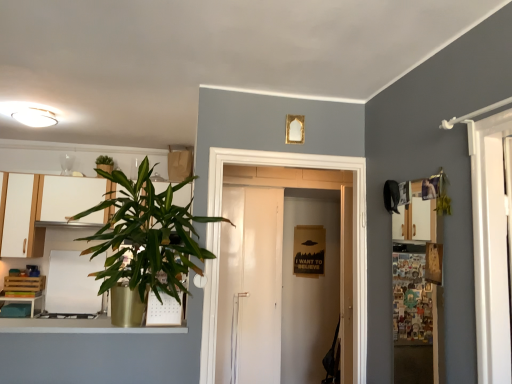
Question: Is white matte cabinet at left, positioned as the first cabinetry in right-to-left order, at the left side of wooden cutting board at upper right?

Choices:
 (A) yes
 (B) no

Answer: (A)

Question: Is white matte cabinet at left, the 2th cabinetry from the left, facing towards wooden cutting board at upper right?

Choices:
 (A) yes
 (B) no

Answer: (B)

Question: From the image's perspective, is white matte cabinet at left, the 2th cabinetry from the left, located above wooden cutting board at upper right?

Choices:
 (A) no
 (B) yes

Answer: (B)

Question: Is white matte cabinet at left, positioned as the first cabinetry in right-to-left order, not inside wooden cutting board at upper right?

Choices:
 (A) yes
 (B) no

Answer: (A)

Question: Is white matte cabinet at left, positioned as the first cabinetry in right-to-left order, beside wooden cutting board at upper right?

Choices:
 (A) yes
 (B) no

Answer: (B)

Question: Is wooden cutting board at upper right at the back of white matte cabinet at left, positioned as the first cabinetry in right-to-left order?

Choices:
 (A) no
 (B) yes

Answer: (A)

Question: Is the depth of white matte dry erase board at left less than that of wooden cutting board at upper right?

Choices:
 (A) no
 (B) yes

Answer: (A)

Question: Can you confirm if white matte dry erase board at left is smaller than wooden cutting board at upper right?

Choices:
 (A) yes
 (B) no

Answer: (B)

Question: Is there a large distance between white matte dry erase board at left and wooden cutting board at upper right?

Choices:
 (A) no
 (B) yes

Answer: (B)

Question: Does white matte dry erase board at left contain wooden cutting board at upper right?

Choices:
 (A) no
 (B) yes

Answer: (A)

Question: Is white matte dry erase board at left further to the viewer compared to wooden cutting board at upper right?

Choices:
 (A) yes
 (B) no

Answer: (A)

Question: Is white matte dry erase board at left outside of wooden cutting board at upper right?

Choices:
 (A) no
 (B) yes

Answer: (B)

Question: Is matte white cabinet at left, which appears as the 1th cabinetry when viewed from the left, outside green leafy plant at upper left, the 1th houseplant positioned from the back?

Choices:
 (A) yes
 (B) no

Answer: (A)